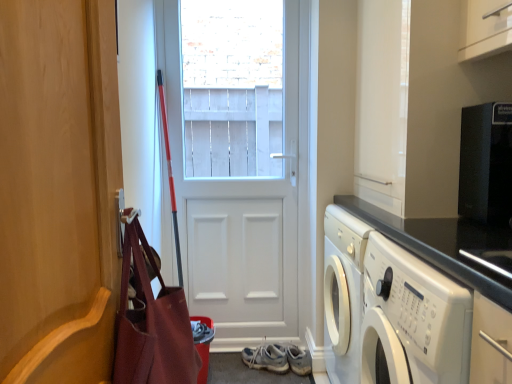
Where is `free spot below light blue fabric sneakers at center (from a real-world perspective)`? The image size is (512, 384). free spot below light blue fabric sneakers at center (from a real-world perspective) is located at coordinates (276, 367).